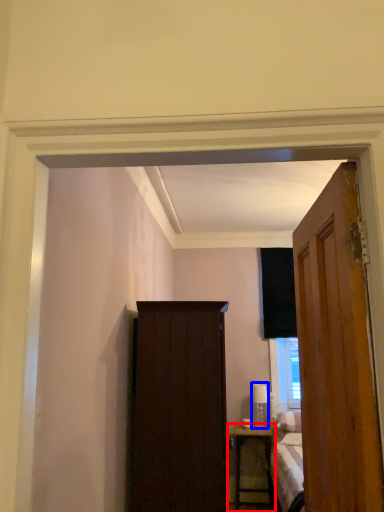
Question: Which of the following is the closest to the observer, nightstand (highlighted by a red box) or lamp (highlighted by a blue box)?

Choices:
 (A) nightstand
 (B) lamp

Answer: (A)